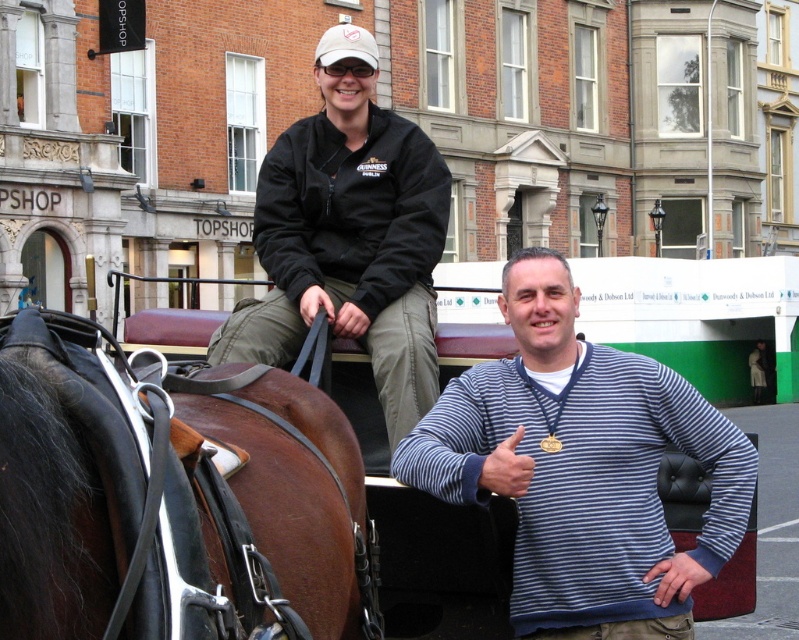
Does brown leather saddle at upper left have a lesser width compared to blue striped sweater at center?

Yes, brown leather saddle at upper left is thinner than blue striped sweater at center.

Between point (42, 573) and point (491, 449), which one is positioned in front?

Point (42, 573) is more forward.

Where is `brown leather saddle at upper left`? brown leather saddle at upper left is located at coordinates (173, 497).

Who is more distant from viewer, (479, 445) or (348, 154)?

The point (348, 154) is more distant.

Is blue striped sweater at center shorter than striped sweater at center?

Indeed, blue striped sweater at center has a lesser height compared to striped sweater at center.

In the scene shown: Who is more forward, (680,401) or (336,243)?

Point (680,401)

Where is `blue striped sweater at center`? blue striped sweater at center is located at coordinates (581, 467).

Which is above, brown leather saddle at upper left or striped sweater at center?

Positioned higher is striped sweater at center.

Where is `brown leather saddle at upper left`? The height and width of the screenshot is (640, 799). brown leather saddle at upper left is located at coordinates (173, 497).